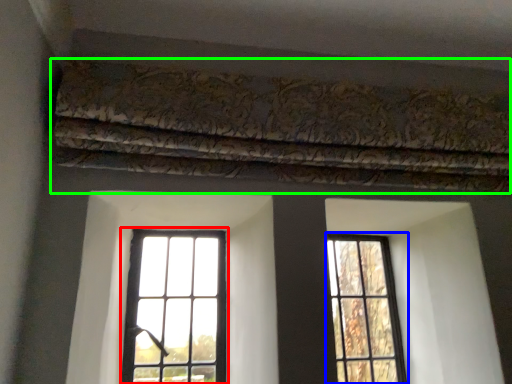
Question: Considering the real-world distances, which object is farthest from window (highlighted by a red box)? window (highlighted by a blue box) or curtain (highlighted by a green box)?

Choices:
 (A) window
 (B) curtain

Answer: (B)